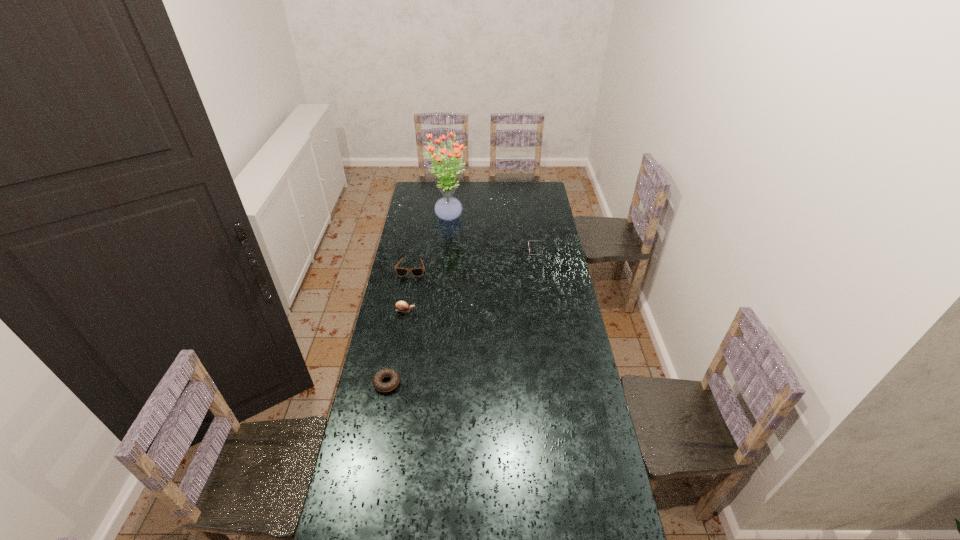
At what (x,y) coordinates should I click in order to perform the action: click on flower arrangement. Please return your answer as a coordinate pair (x, y). Looking at the image, I should click on (448, 208).

Locate an element on the screen. Image resolution: width=960 pixels, height=540 pixels. the tallest object is located at coordinates (448, 208).

Find the location of `escargot`. escargot is located at coordinates (402, 306).

Locate an element on the screen. This screenshot has width=960, height=540. the third nearest object is located at coordinates tap(402, 272).

This screenshot has width=960, height=540. What are the coordinates of `the nearer sunglasses` in the screenshot? It's located at (402, 272).

This screenshot has height=540, width=960. What are the coordinates of `the right sunglasses` in the screenshot? It's located at (528, 241).

In order to click on the rightmost object in this screenshot , I will do `click(528, 241)`.

Identify the location of the shortest object. point(386,372).

The height and width of the screenshot is (540, 960). What are the coordinates of `the nearest object` in the screenshot? It's located at (386, 372).

The width and height of the screenshot is (960, 540). Find the location of `free space located on the left of the tallest object`. free space located on the left of the tallest object is located at coordinates [x=417, y=217].